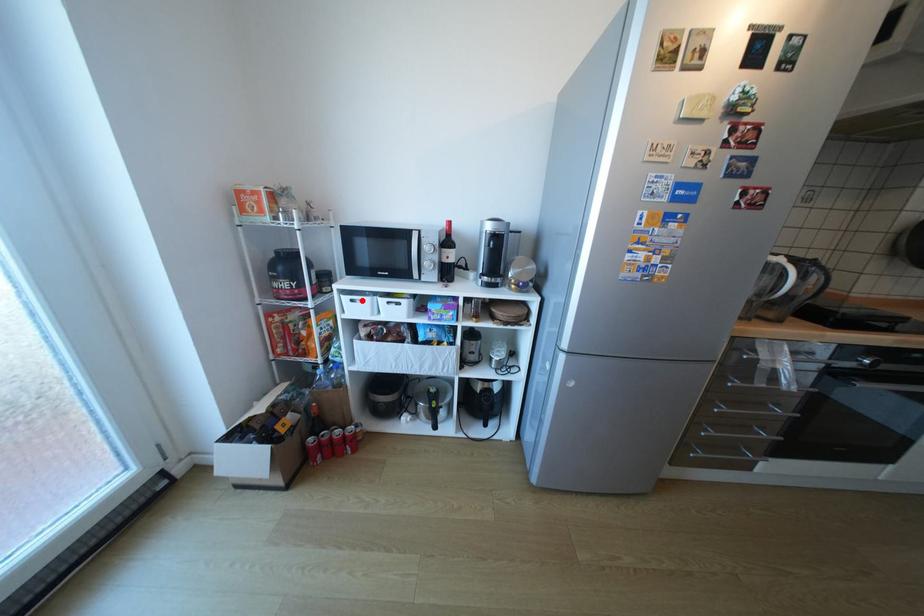
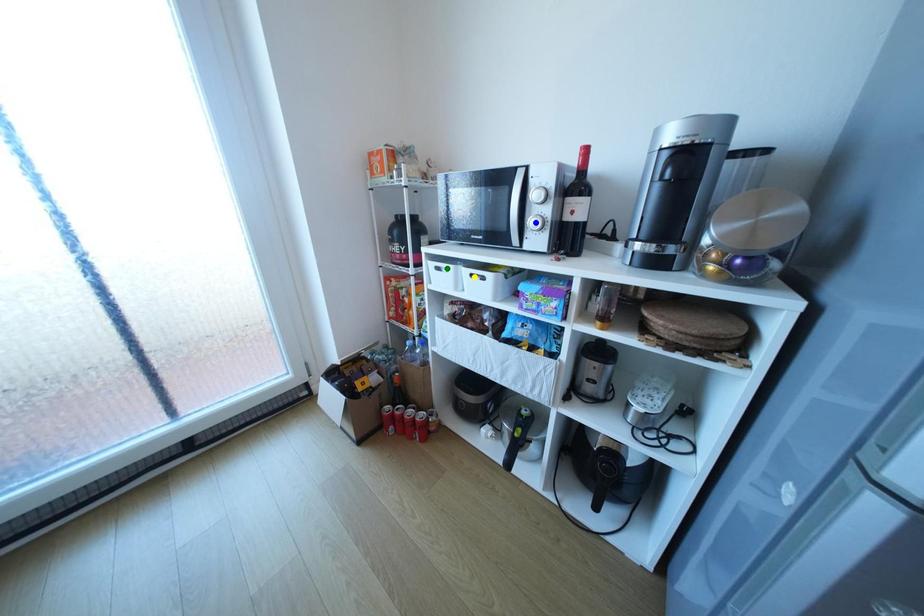
Question: I am providing you with two images of the same scene from different viewpoints. A red point is marked on the first image. You are given multiple points on the second image. Which point in image 2 represents the same 3d spot as the red point in image 1?

Choices:
 (A) green point
 (B) blue point
 (C) yellow point

Answer: (A)